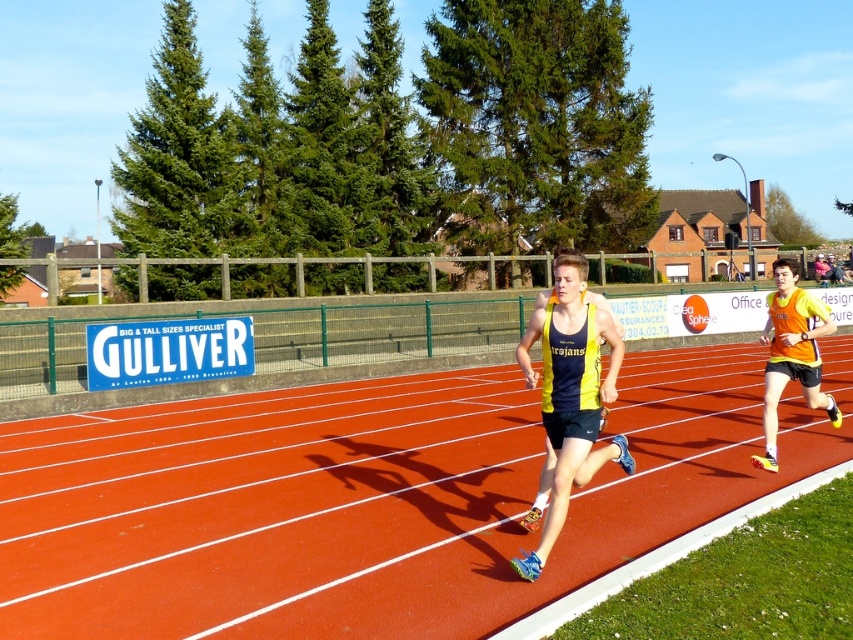
Is yellow-green jersey at center to the left of orange/yellow jersey at right from the viewer's perspective?

Yes, yellow-green jersey at center is to the left of orange/yellow jersey at right.

Image resolution: width=853 pixels, height=640 pixels. What do you see at coordinates (570, 396) in the screenshot?
I see `yellow-green jersey at center` at bounding box center [570, 396].

Is point (548, 371) farther from camera compared to point (769, 449)?

No, it is in front of (769, 449).

Find the location of a particular element. The image size is (853, 640). yellow-green jersey at center is located at coordinates (570, 396).

Which of these two, red rubber track at center or orange/yellow jersey at right, stands shorter?

With less height is red rubber track at center.

Can you confirm if red rubber track at center is taller than orange/yellow jersey at right?

No, red rubber track at center is not taller than orange/yellow jersey at right.

Identify the location of red rubber track at center. Image resolution: width=853 pixels, height=640 pixels. (369, 499).

Can you confirm if red rubber track at center is positioned above yellow-green jersey at center?

No.

Who is more distant from viewer, (450,529) or (573,451)?

Point (450,529)

This screenshot has height=640, width=853. What are the coordinates of `red rubber track at center` in the screenshot? It's located at (369, 499).